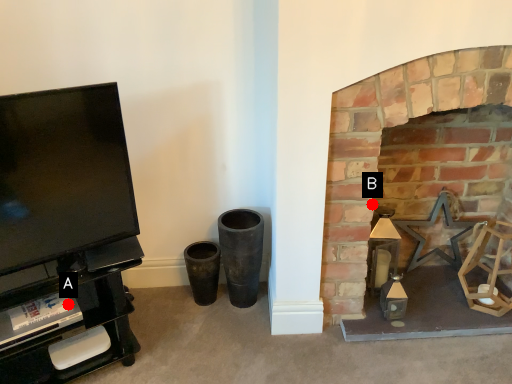
Question: Two points are circled on the image, labeled by A and B beside each circle. Among these points, which one is nearest to the camera?

Choices:
 (A) A is closer
 (B) B is closer

Answer: (A)